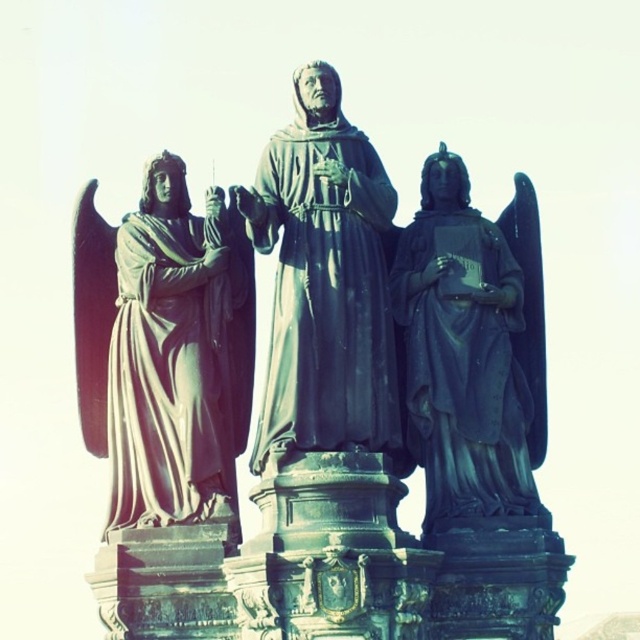
Question: Does matte black statue at right appear on the right side of bronze statue at center?

Choices:
 (A) no
 (B) yes

Answer: (B)

Question: Which point appears farthest from the camera in this image?

Choices:
 (A) (125, 420)
 (B) (301, 360)

Answer: (A)

Question: Observing the image, what is the correct spatial positioning of matte bronze statue at left in reference to bronze statue at center?

Choices:
 (A) right
 (B) left

Answer: (B)

Question: Which point is farther to the camera?

Choices:
 (A) matte bronze statue at left
 (B) bronze statue at center
 (C) matte black statue at right

Answer: (C)

Question: Among these objects, which one is nearest to the camera?

Choices:
 (A) matte black statue at right
 (B) bronze statue at center

Answer: (B)

Question: Does matte black statue at right have a smaller size compared to matte bronze statue at left?

Choices:
 (A) no
 (B) yes

Answer: (A)